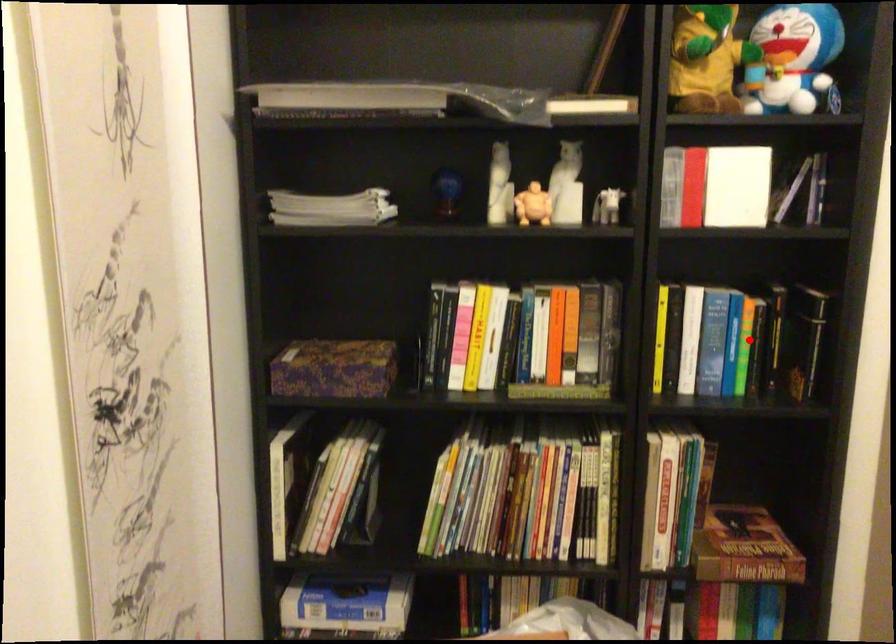
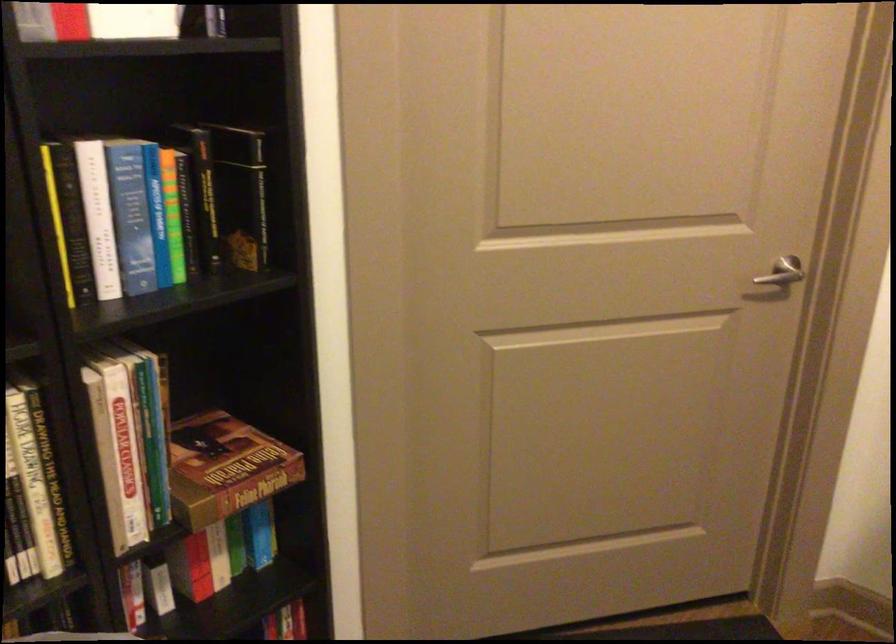
Question: I am providing you with two images of the same scene from different viewpoints. In image1, a red point is highlighted. Considering the same 3D point in image2, which of the following is correct?

Choices:
 (A) It is closer
 (B) It is farther

Answer: (A)